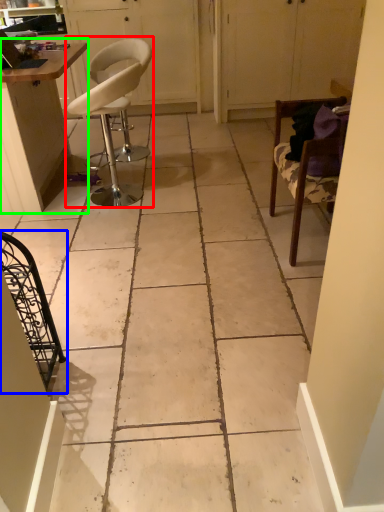
Question: Based on their relative distances, which object is nearer to chair (highlighted by a red box)? Choose from chair (highlighted by a blue box) and table (highlighted by a green box).

Choices:
 (A) chair
 (B) table

Answer: (B)